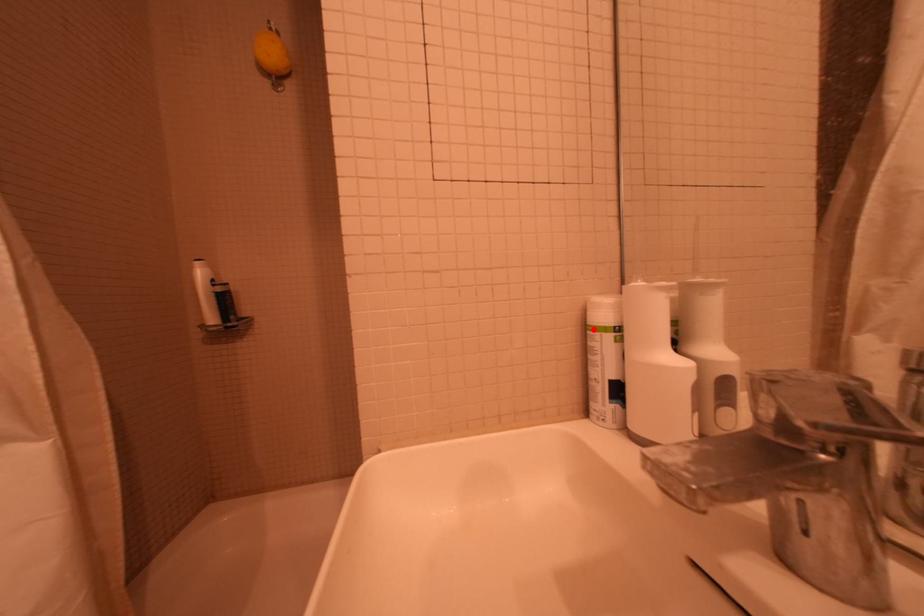
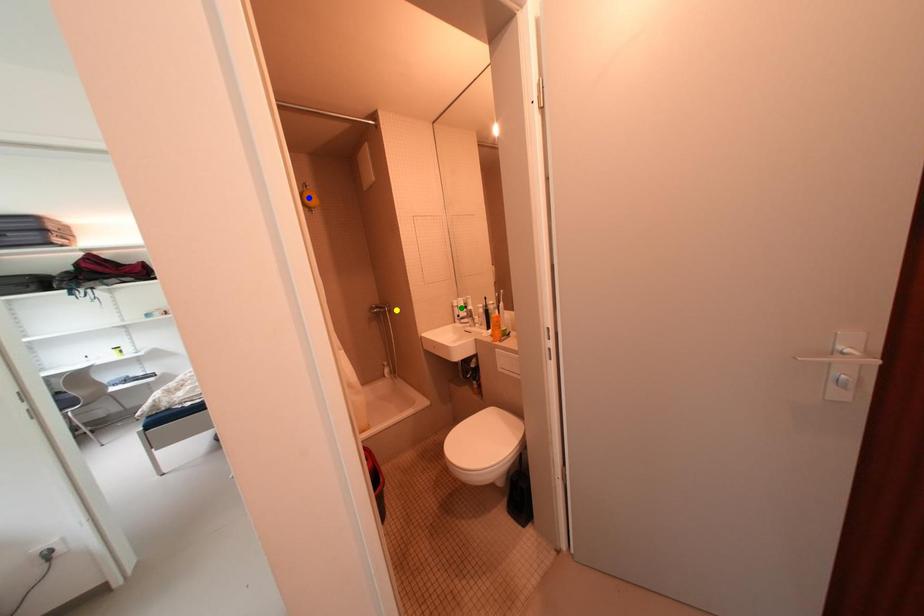
Question: I am providing you with two images of the same scene from different viewpoints. A red point is marked on the first image. You are given multiple points on the second image. Which point in image 2 is actually the same real-world point as the red point in image 1?

Choices:
 (A) blue point
 (B) yellow point
 (C) green point

Answer: (C)